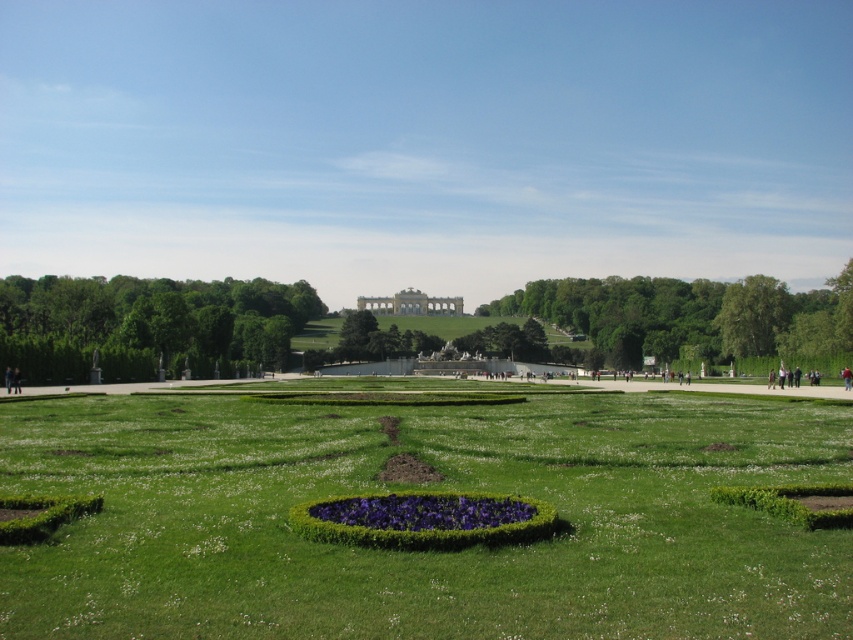
Question: Which point is farther to the camera?

Choices:
 (A) white stone palace at center
 (B) green leafy hedge at left

Answer: (A)

Question: Can you confirm if green leafy hedge at left is wider than purple matte flower bed at center?

Choices:
 (A) yes
 (B) no

Answer: (A)

Question: Which object is positioned farthest from the green hedge at center?

Choices:
 (A) green grass at center
 (B) green leafy hedge at left
 (C) white stone palace at center
 (D) purple matte flower bed at center

Answer: (D)

Question: From the image, what is the correct spatial relationship of green leafy hedge at left in relation to purple matte flower bed at center?

Choices:
 (A) above
 (B) below

Answer: (A)

Question: From the image, what is the correct spatial relationship of green grass at center in relation to green hedge at center?

Choices:
 (A) below
 (B) above

Answer: (A)

Question: Which object is the closest to the green grass at center?

Choices:
 (A) green hedge at center
 (B) green leafy hedge at left

Answer: (B)